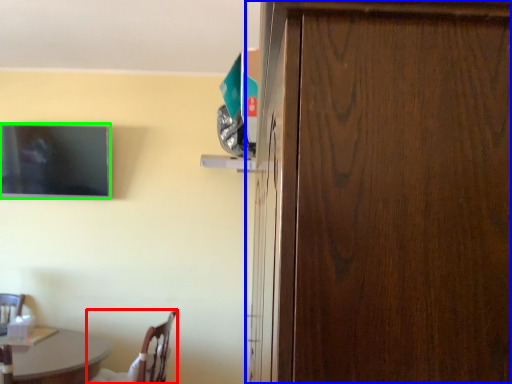
Question: Considering the real-world distances, which object is closest to chair (highlighted by a red box)? door (highlighted by a blue box) or television (highlighted by a green box).

Choices:
 (A) door
 (B) television

Answer: (B)